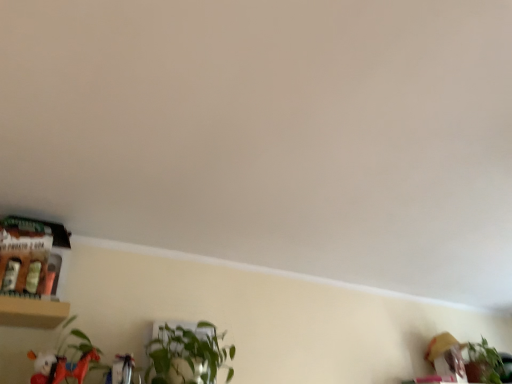
Question: Can you confirm if green leafy plant at center, which is the 2th houseplant in right-to-left order, is bigger than green leafy plant at lower right, the 2th houseplant viewed from the left?

Choices:
 (A) no
 (B) yes

Answer: (B)

Question: Is green leafy plant at center, the 1th houseplant viewed from the top, beside green leafy plant at lower right, placed as the 1th houseplant when sorted from bottom to top?

Choices:
 (A) no
 (B) yes

Answer: (A)

Question: From the image's perspective, is green leafy plant at center, which is counted as the second houseplant, starting from the back, above green leafy plant at lower right, which ranks as the 2th houseplant in front-to-back order?

Choices:
 (A) no
 (B) yes

Answer: (B)

Question: Is green leafy plant at lower right, placed as the 2th houseplant when sorted from top to bottom, completely or partially inside green leafy plant at center, the 1th houseplant viewed from the top?

Choices:
 (A) yes
 (B) no

Answer: (B)

Question: Considering the relative sizes of green leafy plant at center, the 1th houseplant viewed from the top, and green leafy plant at lower right, placed as the 1th houseplant when sorted from bottom to top, in the image provided, is green leafy plant at center, the 1th houseplant viewed from the top, taller than green leafy plant at lower right, placed as the 1th houseplant when sorted from bottom to top,?

Choices:
 (A) no
 (B) yes

Answer: (A)

Question: Can you confirm if green leafy plant at center, the first houseplant viewed from the left, is positioned to the right of green leafy plant at lower right, which is counted as the first houseplant, starting from the right?

Choices:
 (A) yes
 (B) no

Answer: (B)

Question: Does green leafy plant at lower right, the 2th houseplant viewed from the left, come behind matte white plush at lower left?

Choices:
 (A) yes
 (B) no

Answer: (A)

Question: From a real-world perspective, is green leafy plant at lower right, which is counted as the first houseplant, starting from the right, physically above matte white plush at lower left?

Choices:
 (A) no
 (B) yes

Answer: (B)

Question: Considering the relative sizes of green leafy plant at lower right, which ranks as the 2th houseplant in front-to-back order, and matte white plush at lower left in the image provided, is green leafy plant at lower right, which ranks as the 2th houseplant in front-to-back order, thinner than matte white plush at lower left?

Choices:
 (A) yes
 (B) no

Answer: (B)

Question: Can you confirm if green leafy plant at lower right, which appears as the first houseplant when viewed from the back, is taller than matte white plush at lower left?

Choices:
 (A) no
 (B) yes

Answer: (B)

Question: From the image's perspective, is green leafy plant at lower right, which ranks as the 2th houseplant in front-to-back order, below matte white plush at lower left?

Choices:
 (A) no
 (B) yes

Answer: (B)

Question: Does green leafy plant at lower right, which appears as the first houseplant when viewed from the back, have a smaller size compared to matte white plush at lower left?

Choices:
 (A) yes
 (B) no

Answer: (B)

Question: Is green leafy plant at center, the 2th houseplant in the bottom-to-top sequence, next to matte white plush at lower left?

Choices:
 (A) no
 (B) yes

Answer: (A)